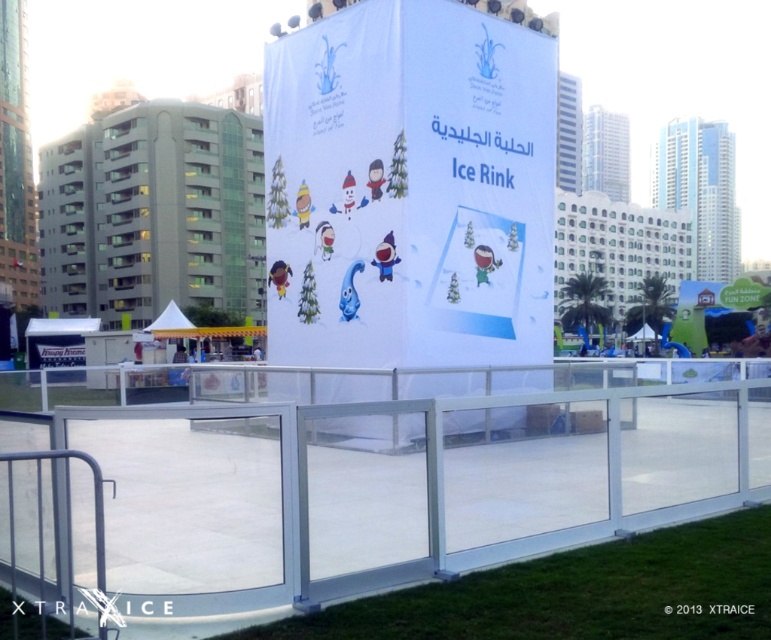
Question: Among these objects, which one is nearest to the camera?

Choices:
 (A) white paper ice rink at center
 (B) clear plastic rail at center

Answer: (B)

Question: Among these objects, which one is nearest to the camera?

Choices:
 (A) clear plastic rail at center
 (B) white paper ice rink at center

Answer: (A)

Question: Which point is closer to the camera?

Choices:
 (A) white paper ice rink at center
 (B) clear plastic rail at center

Answer: (B)

Question: Does clear plastic rail at center come in front of white paper ice rink at center?

Choices:
 (A) yes
 (B) no

Answer: (A)

Question: Does clear plastic rail at center have a larger size compared to white paper ice rink at center?

Choices:
 (A) yes
 (B) no

Answer: (A)

Question: Does clear plastic rail at center appear on the left side of white paper ice rink at center?

Choices:
 (A) no
 (B) yes

Answer: (B)